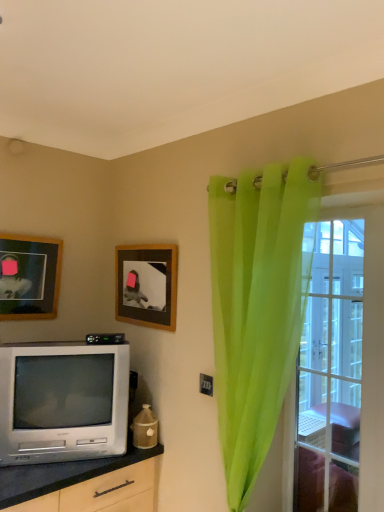
Question: Does clear glass door at right have a larger size compared to translucent green curtain at right?

Choices:
 (A) yes
 (B) no

Answer: (B)

Question: Can you confirm if clear glass door at right is taller than translucent green curtain at right?

Choices:
 (A) yes
 (B) no

Answer: (B)

Question: From the image's perspective, would you say clear glass door at right is shown under translucent green curtain at right?

Choices:
 (A) yes
 (B) no

Answer: (A)

Question: Is translucent green curtain at right surrounded by clear glass door at right?

Choices:
 (A) yes
 (B) no

Answer: (B)

Question: Can you confirm if clear glass door at right is wider than translucent green curtain at right?

Choices:
 (A) yes
 (B) no

Answer: (B)

Question: From the image's perspective, is wooden picture frame at upper left, the second picture frame in the right-to-left sequence, above or below translucent green curtain at right?

Choices:
 (A) above
 (B) below

Answer: (A)

Question: Would you say wooden picture frame at upper left, the second picture frame in the right-to-left sequence, is to the left or to the right of translucent green curtain at right in the picture?

Choices:
 (A) left
 (B) right

Answer: (A)

Question: Is wooden picture frame at upper left, which appears as the 1th picture frame when viewed from the left, wider or thinner than translucent green curtain at right?

Choices:
 (A) thin
 (B) wide

Answer: (A)

Question: Choose the correct answer: Is wooden picture frame at upper left, the second picture frame in the right-to-left sequence, inside translucent green curtain at right or outside it?

Choices:
 (A) outside
 (B) inside

Answer: (A)

Question: Considering the positions of translucent green curtain at right and silver metallic television at lower left in the image, is translucent green curtain at right wider or thinner than silver metallic television at lower left?

Choices:
 (A) wide
 (B) thin

Answer: (B)

Question: Considering the positions of translucent green curtain at right and silver metallic television at lower left in the image, is translucent green curtain at right taller or shorter than silver metallic television at lower left?

Choices:
 (A) short
 (B) tall

Answer: (B)

Question: From the image's perspective, relative to silver metallic television at lower left, is translucent green curtain at right above or below?

Choices:
 (A) above
 (B) below

Answer: (A)

Question: Does point (233, 382) appear closer or farther from the camera than point (29, 419)?

Choices:
 (A) farther
 (B) closer

Answer: (B)

Question: Would you say clear glass door at right is to the left or to the right of translucent green curtain at right in the picture?

Choices:
 (A) left
 (B) right

Answer: (B)

Question: Is point (372, 260) positioned closer to the camera than point (228, 455)?

Choices:
 (A) closer
 (B) farther

Answer: (A)